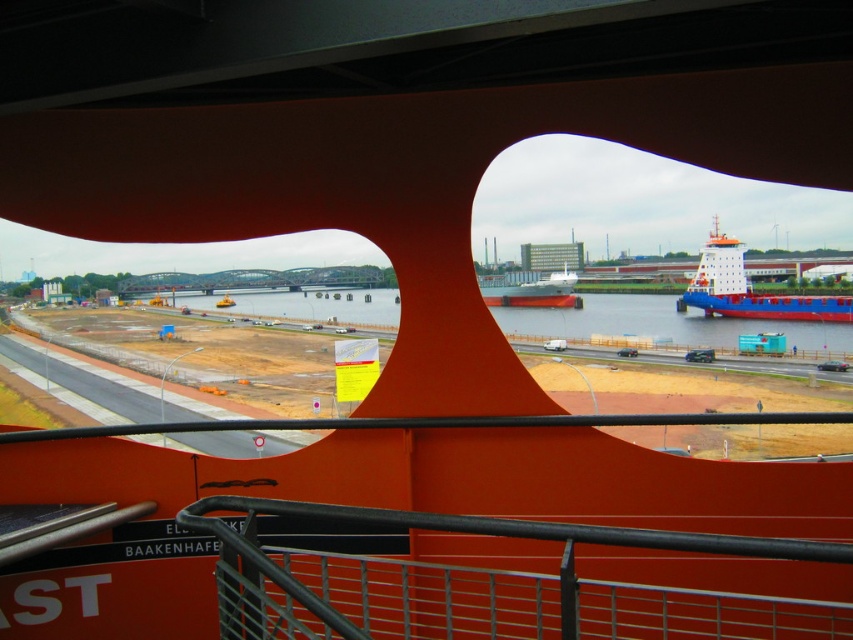
Question: Which of the following is the closest to the observer?

Choices:
 (A) blue matte container ship at right
 (B) white matte cargo ship at center

Answer: (B)

Question: Considering the relative positions of metallic gray rail at center and blue matte container ship at right in the image provided, where is metallic gray rail at center located with respect to blue matte container ship at right?

Choices:
 (A) right
 (B) left

Answer: (B)

Question: Estimate the real-world distances between objects in this image. Which object is closer to the metallic gray rail at center?

Choices:
 (A) blue water at center
 (B) white matte cargo ship at center

Answer: (B)

Question: Is metallic gray rail at center closer to the viewer compared to blue matte container ship at right?

Choices:
 (A) no
 (B) yes

Answer: (B)

Question: Estimate the real-world distances between objects in this image. Which object is closer to the blue matte container ship at right?

Choices:
 (A) white matte cargo ship at center
 (B) blue water at center

Answer: (B)

Question: Can you confirm if metallic gray rail at center is positioned above white matte cargo ship at center?

Choices:
 (A) no
 (B) yes

Answer: (A)